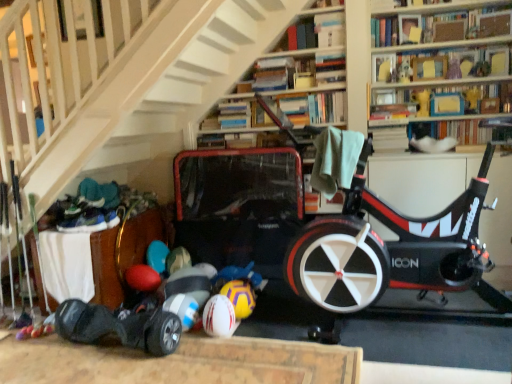
Image resolution: width=512 pixels, height=384 pixels. Identify the location of blue cardboard book at upper right, the third book positioned from the bottom. pos(439,96).

What do you see at coordinates (306, 32) in the screenshot? I see `hardcover book at upper center, marked as the fifth book in a bottom-to-top arrangement` at bounding box center [306, 32].

In order to face hardcover book at upper center, the 2th book positioned from the top, should I rotate leftwards or rightwards?

Rotate right and turn 8.137 degrees.

What do you see at coordinates (234, 115) in the screenshot? The image size is (512, 384). I see `hardcover book at upper center, which is counted as the 5th book, starting from the top` at bounding box center [234, 115].

What do you see at coordinates (441, 64) in the screenshot? I see `matte cardboard book at upper right, marked as the third book in a top-to-bottom arrangement` at bounding box center [441, 64].

What do you see at coordinates (219, 317) in the screenshot? I see `white matte rugby ball at lower center` at bounding box center [219, 317].

Locate an element on the screen. Image resolution: width=512 pixels, height=384 pixels. blue cardboard book at upper right, which appears as the 4th book when viewed from the top is located at coordinates (439, 96).

Consider the image. From the image's perspective, does hardcover book at upper center, marked as the fifth book in a bottom-to-top arrangement, appear higher than hardcover book at upper center, which is the second book in bottom-to-top order?

Yes, from the image's perspective, hardcover book at upper center, marked as the fifth book in a bottom-to-top arrangement, is on top of hardcover book at upper center, which is the second book in bottom-to-top order.

From a real-world perspective, relative to hardcover book at upper center, which is counted as the 5th book, starting from the top, is hardcover book at upper center, the 2th book positioned from the top, vertically above or below?

From a real-world perspective, hardcover book at upper center, the 2th book positioned from the top, is physically above hardcover book at upper center, which is counted as the 5th book, starting from the top.

Does hardcover book at upper center, marked as the fifth book in a bottom-to-top arrangement, have a smaller size compared to hardcover book at upper center, which is the second book in bottom-to-top order?

No.

Is hardcover book at upper center, which is counted as the 5th book, starting from the top, at the back of hardcover book at upper center, the 2th book positioned from the top?

hardcover book at upper center, the 2th book positioned from the top, does not have its back to hardcover book at upper center, which is counted as the 5th book, starting from the top.

Could you tell me if hardcover book at upper center, the sixth book when ordered from bottom to top, is turned towards hardcover book at upper center, marked as the fifth book in a bottom-to-top arrangement?

No, hardcover book at upper center, the sixth book when ordered from bottom to top, is not facing towards hardcover book at upper center, marked as the fifth book in a bottom-to-top arrangement.

Are hardcover book at upper center, the 1th book when ordered from top to bottom, and hardcover book at upper center, marked as the fifth book in a bottom-to-top arrangement, making contact?

They are not placed beside each other.

Is hardcover book at upper center, the 1th book when ordered from top to bottom, completely or partially outside of hardcover book at upper center, the 2th book positioned from the top?

Yes, hardcover book at upper center, the 1th book when ordered from top to bottom, is not within hardcover book at upper center, the 2th book positioned from the top.

From a real-world perspective, is hardcover book at upper center, the sixth book when ordered from bottom to top, positioned above or below hardcover book at upper center, marked as the fifth book in a bottom-to-top arrangement?

hardcover book at upper center, the sixth book when ordered from bottom to top, is below hardcover book at upper center, marked as the fifth book in a bottom-to-top arrangement.

Considering the sizes of objects white matte rugby ball at lower center and blue cardboard book at upper right, which appears as the 4th book when viewed from the top, in the image provided, who is wider, white matte rugby ball at lower center or blue cardboard book at upper right, which appears as the 4th book when viewed from the top,?

With larger width is white matte rugby ball at lower center.

Is white matte rugby ball at lower center oriented towards blue cardboard book at upper right, which appears as the 4th book when viewed from the top?

No, white matte rugby ball at lower center is not turned towards blue cardboard book at upper right, which appears as the 4th book when viewed from the top.

Who is taller, white matte rugby ball at lower center or blue cardboard book at upper right, which appears as the 4th book when viewed from the top?

blue cardboard book at upper right, which appears as the 4th book when viewed from the top.

Considering the positions of objects white matte rugby ball at lower center and blue cardboard book at upper right, which appears as the 4th book when viewed from the top, in the image provided, who is in front, white matte rugby ball at lower center or blue cardboard book at upper right, which appears as the 4th book when viewed from the top,?

white matte rugby ball at lower center.

Is point (439, 137) in front of point (493, 51)?

No, (439, 137) is further to viewer.

Looking at this image, is hardcover book at upper right, the 6th book in the top-to-bottom sequence, touching matte cardboard book at upper right, which is the 4th book from bottom to top?

No, hardcover book at upper right, the 6th book in the top-to-bottom sequence, is not touching matte cardboard book at upper right, which is the 4th book from bottom to top.

Is hardcover book at upper right, which is counted as the 1th book, starting from the bottom, aimed at matte cardboard book at upper right, which is the 4th book from bottom to top?

No, hardcover book at upper right, which is counted as the 1th book, starting from the bottom, is not facing towards matte cardboard book at upper right, which is the 4th book from bottom to top.

Is matte cardboard book at upper right, which is the 4th book from bottom to top, located within hardcover book at upper right, which is counted as the 1th book, starting from the bottom?

No, matte cardboard book at upper right, which is the 4th book from bottom to top, is located outside of hardcover book at upper right, which is counted as the 1th book, starting from the bottom.

In terms of width, does hardcover book at upper center, the 1th book when ordered from top to bottom, look wider or thinner when compared to wooden chest at lower left?

hardcover book at upper center, the 1th book when ordered from top to bottom, is thinner than wooden chest at lower left.

Considering the sizes of hardcover book at upper center, the 1th book when ordered from top to bottom, and wooden chest at lower left in the image, is hardcover book at upper center, the 1th book when ordered from top to bottom, bigger or smaller than wooden chest at lower left?

Considering their sizes, hardcover book at upper center, the 1th book when ordered from top to bottom, takes up less space than wooden chest at lower left.

Based on the photo, is hardcover book at upper center, the 1th book when ordered from top to bottom, in contact with wooden chest at lower left?

hardcover book at upper center, the 1th book when ordered from top to bottom, and wooden chest at lower left are not in contact.

From the picture: Could you tell me if hardcover book at upper center, the 1th book when ordered from top to bottom, is facing wooden chest at lower left?

No, hardcover book at upper center, the 1th book when ordered from top to bottom, is not turned towards wooden chest at lower left.

Can you tell me how much wooden chest at lower left and hardcover book at upper right, the 6th book in the top-to-bottom sequence, differ in facing direction?

The angle between the facing direction of wooden chest at lower left and the facing direction of hardcover book at upper right, the 6th book in the top-to-bottom sequence, is 1.35 degrees.

Considering the sizes of wooden chest at lower left and hardcover book at upper right, the 6th book in the top-to-bottom sequence, in the image, is wooden chest at lower left wider or thinner than hardcover book at upper right, the 6th book in the top-to-bottom sequence,?

Considering their sizes, wooden chest at lower left looks broader than hardcover book at upper right, the 6th book in the top-to-bottom sequence.

Is wooden chest at lower left facing away from hardcover book at upper right, which is counted as the 1th book, starting from the bottom?

No, wooden chest at lower left is not facing away from hardcover book at upper right, which is counted as the 1th book, starting from the bottom.

From the image's perspective, is wooden chest at lower left located above hardcover book at upper right, the 6th book in the top-to-bottom sequence?

No, from the image's perspective, wooden chest at lower left is not over hardcover book at upper right, the 6th book in the top-to-bottom sequence.

Could you measure the distance between wooden chest at lower left and hardcover book at upper center, marked as the fifth book in a bottom-to-top arrangement?

A distance of 1.67 meters exists between wooden chest at lower left and hardcover book at upper center, marked as the fifth book in a bottom-to-top arrangement.

Which object is closer to the camera, wooden chest at lower left or hardcover book at upper center, the 2th book positioned from the top?

wooden chest at lower left is closer to the camera.

Does wooden chest at lower left have a lesser height compared to hardcover book at upper center, marked as the fifth book in a bottom-to-top arrangement?

No, wooden chest at lower left is not shorter than hardcover book at upper center, marked as the fifth book in a bottom-to-top arrangement.

Looking at their sizes, would you say wooden chest at lower left is wider or thinner than hardcover book at upper center, the 2th book positioned from the top?

In the image, wooden chest at lower left appears to be wider than hardcover book at upper center, the 2th book positioned from the top.

This screenshot has height=384, width=512. I want to click on book that is the 4th one above the hardcover book at upper center, which is the second book in bottom-to-top order (from a real-world perspective), so click(x=306, y=32).

You are a GUI agent. You are given a task and a screenshot of the screen. Output one action in this format:
    pyautogui.click(x=<x>, y=<y>)
    Task: Click on the book in front of the hardcover book at upper center, the 1th book when ordered from top to bottom
    Image resolution: width=512 pixels, height=384 pixels.
    Given the screenshot: What is the action you would take?
    pyautogui.click(x=306, y=32)

Estimate the real-world distances between objects in this image. Which object is further from yellowtexturebeach ball at lower center, white matte rugby ball at lower center or hardcover book at upper center, which is counted as the 5th book, starting from the top?

The object further to yellowtexturebeach ball at lower center is hardcover book at upper center, which is counted as the 5th book, starting from the top.

From the picture: Based on their spatial positions, is blue cardboard book at upper right, which appears as the 4th book when viewed from the top, or hardcover book at upper center, which is the second book in bottom-to-top order, further from hardcover book at upper center, marked as the fifth book in a bottom-to-top arrangement?

Among the two, blue cardboard book at upper right, which appears as the 4th book when viewed from the top, is located further to hardcover book at upper center, marked as the fifth book in a bottom-to-top arrangement.

Which object lies further to the anchor point hardcover book at upper center, the 1th book when ordered from top to bottom, wooden chest at lower left or matte cardboard book at upper right, which is the 4th book from bottom to top?

Based on the image, wooden chest at lower left appears to be further to hardcover book at upper center, the 1th book when ordered from top to bottom.

When comparing their distances from hardcover book at upper center, the sixth book when ordered from bottom to top, does hardcover book at upper center, the 2th book positioned from the top, or matte cardboard book at upper right, which is the 4th book from bottom to top, seem closer?

The object closer to hardcover book at upper center, the sixth book when ordered from bottom to top, is matte cardboard book at upper right, which is the 4th book from bottom to top.

When comparing their distances from hardcover book at upper center, which is the second book in bottom-to-top order, does blue cardboard book at upper right, the third book positioned from the bottom, or matte cardboard book at upper right, marked as the third book in a top-to-bottom arrangement, seem closer?

Among the two, blue cardboard book at upper right, the third book positioned from the bottom, is located nearer to hardcover book at upper center, which is the second book in bottom-to-top order.

Based on their spatial positions, is white matte rugby ball at lower center or hardcover book at upper center, the sixth book when ordered from bottom to top, further from hardcover book at upper right, which is counted as the 1th book, starting from the bottom?

The object further to hardcover book at upper right, which is counted as the 1th book, starting from the bottom, is white matte rugby ball at lower center.

Looking at the image, which one is located further to hardcover book at upper center, marked as the fifth book in a bottom-to-top arrangement, hardcover book at upper center, the sixth book when ordered from bottom to top, or wooden chest at lower left?

wooden chest at lower left lies further to hardcover book at upper center, marked as the fifth book in a bottom-to-top arrangement, than the other object.

From the image, which object appears to be nearer to white matte rugby ball at lower center, hardcover book at upper center, the sixth book when ordered from bottom to top, or hardcover book at upper center, marked as the fifth book in a bottom-to-top arrangement?

hardcover book at upper center, marked as the fifth book in a bottom-to-top arrangement.

The image size is (512, 384). What are the coordinates of `ball between hardcover book at upper center, which is the second book in bottom-to-top order, and hardcover book at upper center, the sixth book when ordered from bottom to top` in the screenshot? It's located at click(219, 317).

In order to click on beach ball between matte cardboard book at upper right, marked as the third book in a top-to-bottom arrangement, and white matte rugby ball at lower center from top to bottom in this screenshot , I will do `click(240, 297)`.

I want to click on furniture between hardcover book at upper center, which is counted as the 5th book, starting from the top, and white matte rugby ball at lower center, in the vertical direction, so click(x=123, y=253).

Find the location of a particular element. ball between wooden chest at lower left and matte cardboard book at upper right, which is the 4th book from bottom to top, from left to right is located at coordinates (219, 317).